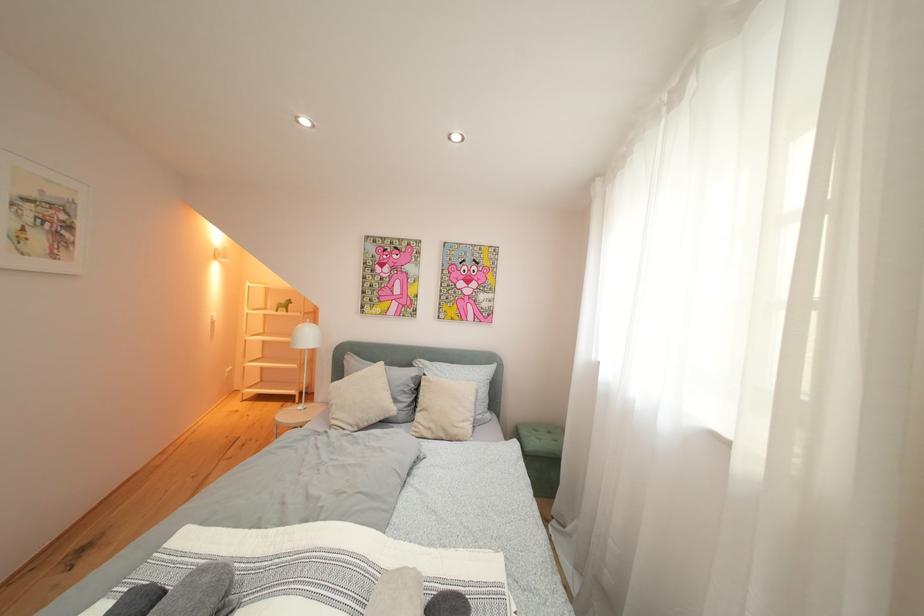
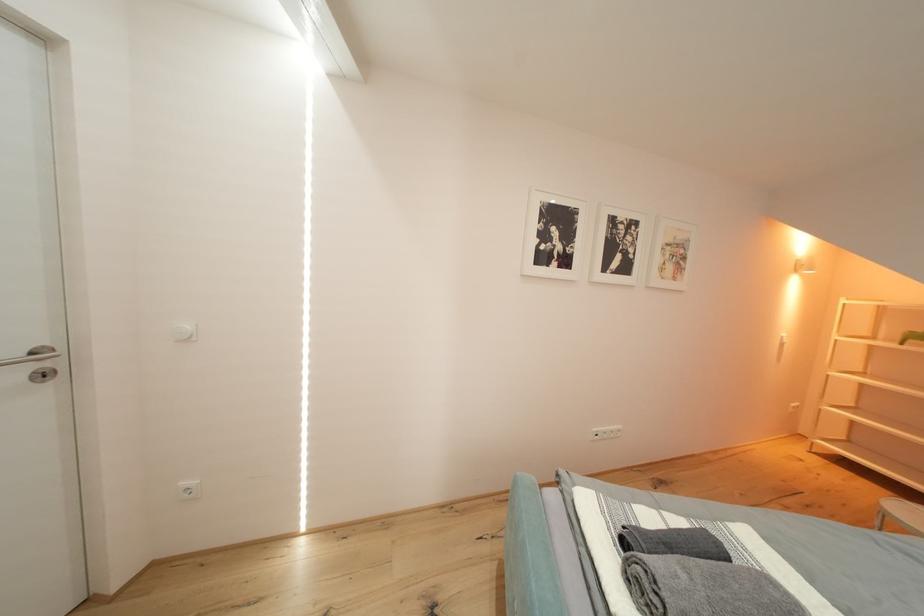
Question: The camera is either moving clockwise (left) or counter-clockwise (right) around the object. The first image is from the beginning of the video and the second image is from the end. Is the camera moving left or right when shooting the video?

Choices:
 (A) Left
 (B) Right

Answer: (B)